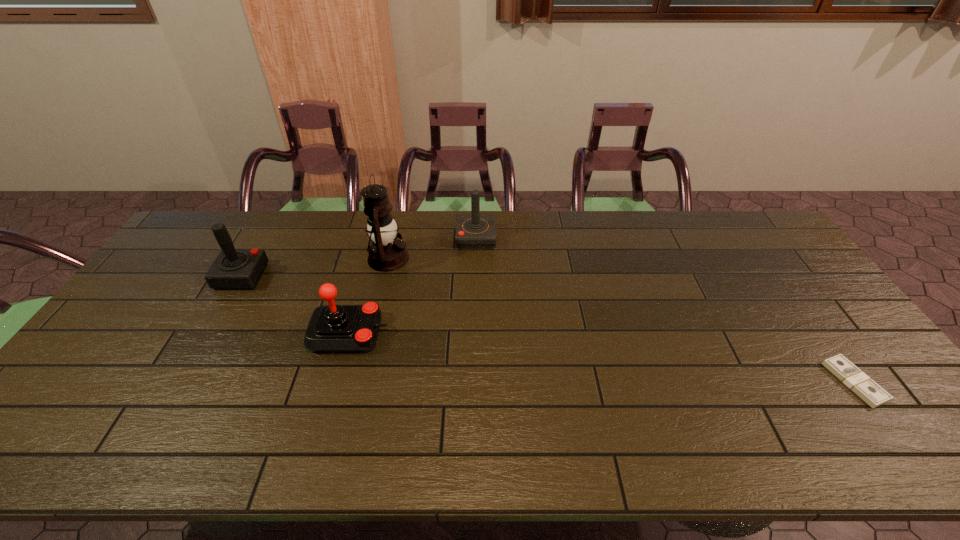
Find the location of a particular element. the tallest object is located at coordinates (387, 253).

Where is `the leftmost joystick`? the leftmost joystick is located at coordinates (234, 268).

I want to click on the second nearest joystick, so click(234, 268).

At what (x,y) coordinates should I click in order to perform the action: click on the fourth object from left to right. Please return your answer as a coordinate pair (x, y). The image size is (960, 540). Looking at the image, I should click on (475, 231).

You are a GUI agent. You are given a task and a screenshot of the screen. Output one action in this format:
    pyautogui.click(x=<x>, y=<y>)
    Task: Click on the rightmost joystick
    This screenshot has height=540, width=960.
    Given the screenshot: What is the action you would take?
    pyautogui.click(x=475, y=231)

This screenshot has width=960, height=540. I want to click on the second nearest object, so click(332, 328).

Locate an element on the screen. the nearest joystick is located at coordinates (332, 328).

The image size is (960, 540). In order to click on the shortest object in this screenshot , I will do `click(868, 390)`.

This screenshot has width=960, height=540. I want to click on the rightmost object, so click(868, 390).

This screenshot has width=960, height=540. I want to click on free space located 0.370m on the side of the lantern, there is a wick adjustment knob, so click(521, 258).